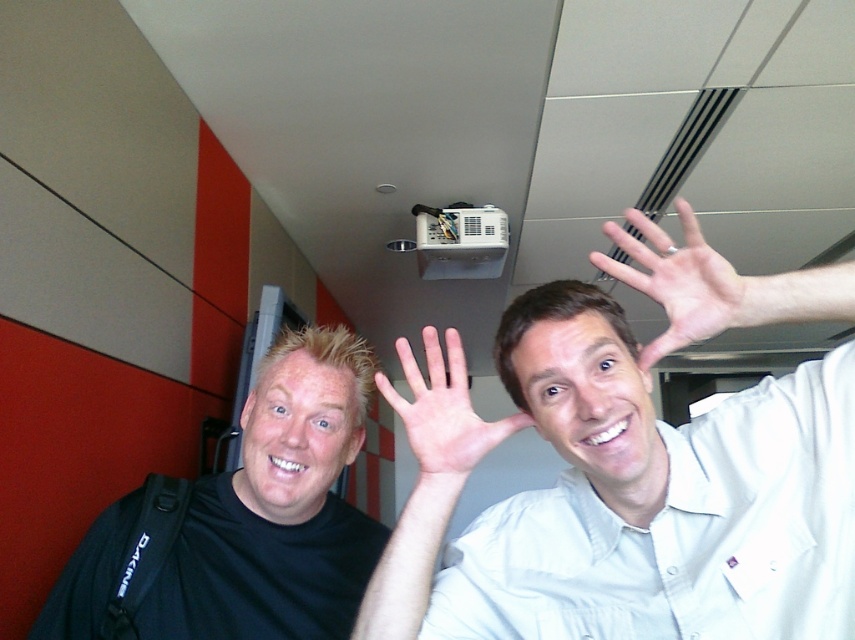
Question: Is white glossy projector at upper center above pale skin palm at center?

Choices:
 (A) yes
 (B) no

Answer: (B)

Question: Which point is farther from the camera taking this photo?

Choices:
 (A) (641, 225)
 (B) (575, 632)

Answer: (B)

Question: Considering the relative positions of white glossy projector at upper center and pale skin palm at center in the image provided, where is white glossy projector at upper center located with respect to pale skin palm at center?

Choices:
 (A) left
 (B) right

Answer: (B)

Question: Among these points, which one is farthest from the camera?

Choices:
 (A) (228, 632)
 (B) (476, 570)

Answer: (A)

Question: Which object appears farthest from the camera in this image?

Choices:
 (A) black matte shirt at left
 (B) white matte hand at upper right

Answer: (A)

Question: Can you confirm if white glossy projector at upper center is positioned below white matte hand at upper right?

Choices:
 (A) no
 (B) yes

Answer: (B)